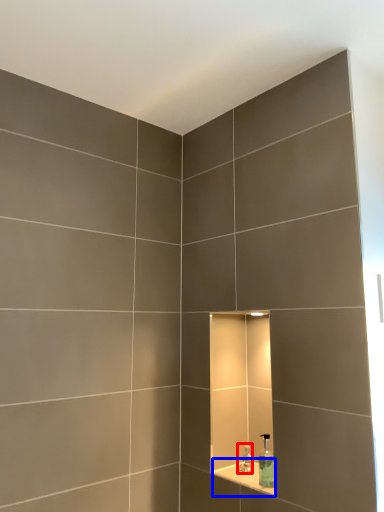
Question: Which object appears farthest to the camera in this image, faucet (highlighted by a red box) or ledge (highlighted by a blue box)?

Choices:
 (A) faucet
 (B) ledge

Answer: (A)